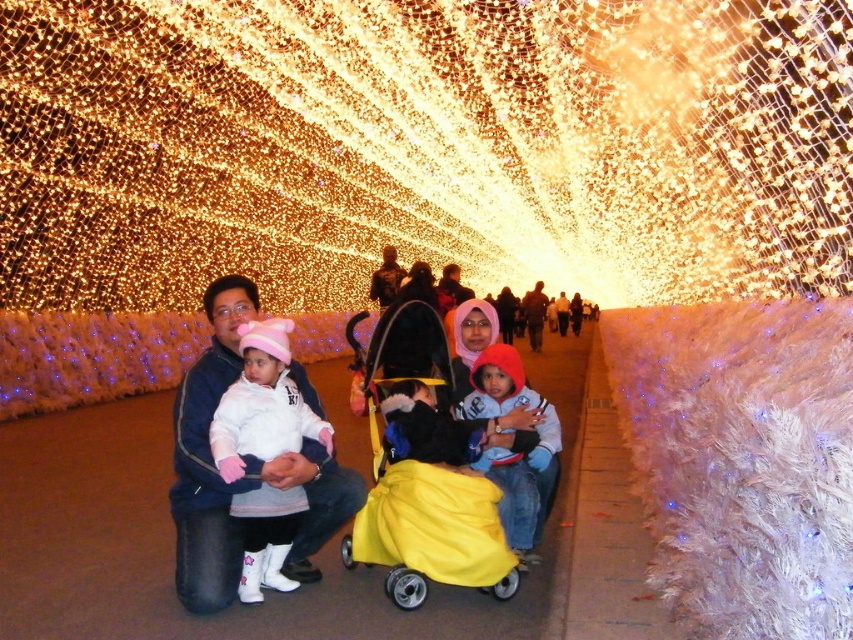
You are a photographer setting up a camera in the tunnel. You need to place a tripod between the yellow fabric baby carriage at center and the matte black stroller at center. The tripod requires 4 feet of space to be placed safely. Can you fit the tripod between them?

The distance between the yellow fabric baby carriage at center and the matte black stroller at center is 5.86 feet. Since the tripod needs 4 feet of space, there is enough room to place it safely between them.

You are a photographer trying to capture a clear shot of both the light blue fleece jacket at center and the dark brown leather jacket at center. Since the camera can only focus on one subject at a time, which jacket should you prioritize focusing on to ensure it appears sharp in the photo?

The light blue fleece jacket at center is in front of the dark brown leather jacket at center, so you should prioritize focusing on the light blue fleece jacket at center to ensure it appears sharp. The dark brown leather jacket at center may still be somewhat in focus but might be slightly blurred due to its position behind the other jacket.